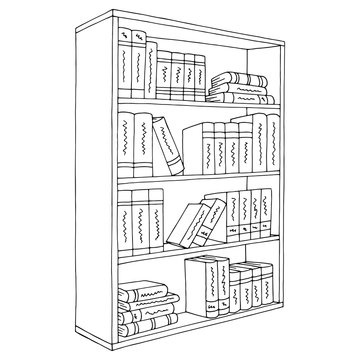
The width and height of the screenshot is (360, 360). Identify the location of third shelf from the top books. (120, 234), (144, 228), (153, 228), (182, 230), (213, 223), (234, 221), (244, 218), (256, 219), (267, 212).